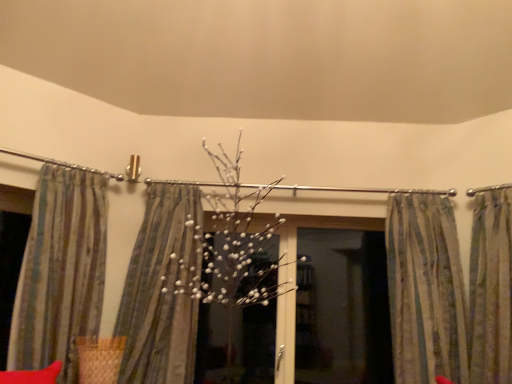
Question: Can you confirm if striped fabric curtain at left, acting as the 1th curtain starting from the left, is positioned to the right of metallic silver clothesline at upper left?

Choices:
 (A) no
 (B) yes

Answer: (B)

Question: From the image's perspective, does striped fabric curtain at left, acting as the 1th curtain starting from the left, appear lower than metallic silver clothesline at upper left?

Choices:
 (A) yes
 (B) no

Answer: (A)

Question: Is striped fabric curtain at left, the 4th curtain from the right, in contact with metallic silver clothesline at upper left?

Choices:
 (A) yes
 (B) no

Answer: (B)

Question: Does striped fabric curtain at left, the 4th curtain from the right, have a greater height compared to metallic silver clothesline at upper left?

Choices:
 (A) yes
 (B) no

Answer: (A)

Question: From a real-world perspective, is striped fabric curtain at left, the 4th curtain from the right, physically above metallic silver clothesline at upper left?

Choices:
 (A) yes
 (B) no

Answer: (B)

Question: In terms of height, does metallic silver clothesline at upper left look taller or shorter compared to striped fabric at center, the third curtain positioned from the right?

Choices:
 (A) short
 (B) tall

Answer: (A)

Question: Looking at their shapes, would you say metallic silver clothesline at upper left is wider or thinner than striped fabric at center, the second curtain from the left?

Choices:
 (A) wide
 (B) thin

Answer: (B)

Question: From the image's perspective, is metallic silver clothesline at upper left positioned above or below striped fabric at center, the third curtain positioned from the right?

Choices:
 (A) above
 (B) below

Answer: (A)

Question: Based on their positions, is metallic silver clothesline at upper left located to the left or right of striped fabric at center, the second curtain from the left?

Choices:
 (A) right
 (B) left

Answer: (B)

Question: Considering the positions of transparent glass screen door at center and striped fabric curtain at left, acting as the 1th curtain starting from the left, in the image, is transparent glass screen door at center wider or thinner than striped fabric curtain at left, acting as the 1th curtain starting from the left,?

Choices:
 (A) thin
 (B) wide

Answer: (A)

Question: From a real-world perspective, is transparent glass screen door at center physically located above or below striped fabric curtain at left, acting as the 1th curtain starting from the left?

Choices:
 (A) below
 (B) above

Answer: (A)

Question: Is transparent glass screen door at center bigger or smaller than striped fabric curtain at left, the 4th curtain from the right?

Choices:
 (A) big
 (B) small

Answer: (B)

Question: Choose the correct answer: Is transparent glass screen door at center inside striped fabric curtain at left, acting as the 1th curtain starting from the left, or outside it?

Choices:
 (A) outside
 (B) inside

Answer: (A)

Question: From a real-world perspective, is metallic silver clothesline at upper left above or below striped fabric curtain at right, the 4th curtain positioned from the left?

Choices:
 (A) below
 (B) above

Answer: (B)

Question: From the image's perspective, is metallic silver clothesline at upper left located above or below striped fabric curtain at right, the first curtain positioned from the right?

Choices:
 (A) below
 (B) above

Answer: (B)